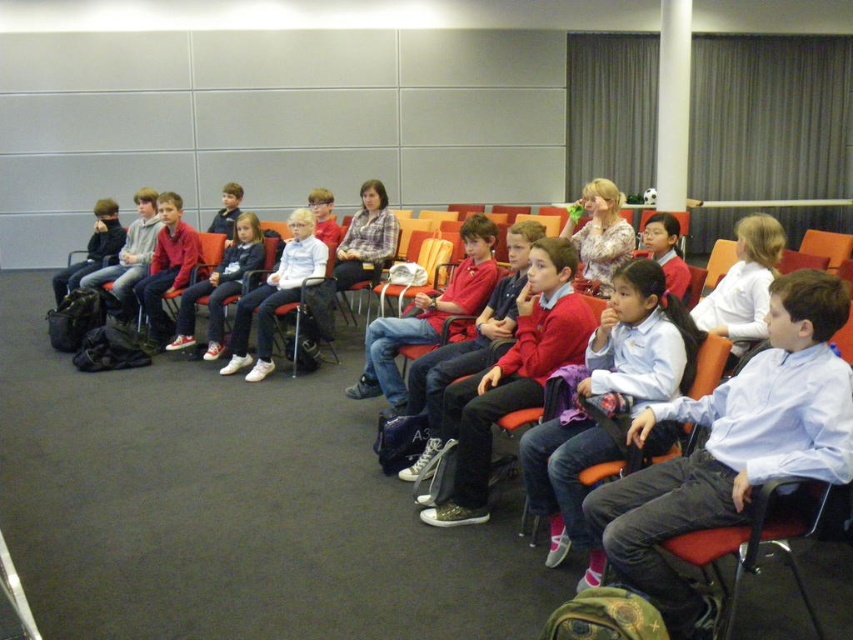
Question: Which is farther from the matte black jacket at left?

Choices:
 (A) matte red sweater at center
 (B) white leather jacket at center
 (C) matte red jacket at center
 (D) blue cotton shirt at center

Answer: (D)

Question: Can you confirm if matte red sweater at center is positioned above matte black jacket at left?

Choices:
 (A) yes
 (B) no

Answer: (B)

Question: Which object appears farthest from the camera in this image?

Choices:
 (A) matte black jacket at left
 (B) blue cotton shirt at center
 (C) white leather jacket at center

Answer: (A)

Question: From the image, what is the correct spatial relationship of matte red sweater at center in relation to matte black jacket at left?

Choices:
 (A) above
 (B) below

Answer: (B)

Question: Can you confirm if matte red sweater at center is wider than matte black jacket at left?

Choices:
 (A) no
 (B) yes

Answer: (A)

Question: Which object is farther from the camera taking this photo?

Choices:
 (A) matte red jacket at center
 (B) matte red sweater at center
 (C) matte black jacket at left
 (D) blue cotton shirt at center

Answer: (C)